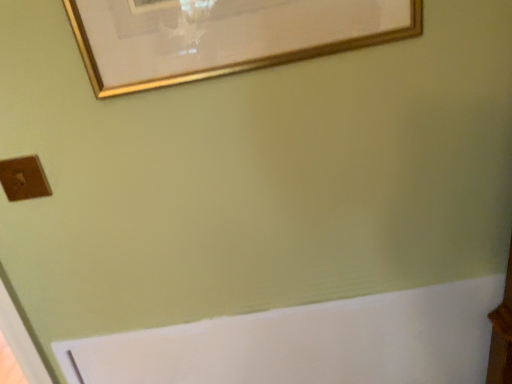
Question: From the image's perspective, is gold metallic picture frame at upper center positioned above or below brown matte/light switch at lower left?

Choices:
 (A) above
 (B) below

Answer: (A)

Question: Is gold metallic picture frame at upper center inside or outside of brown matte/light switch at lower left?

Choices:
 (A) inside
 (B) outside

Answer: (B)

Question: Based on their positions, is gold metallic picture frame at upper center located to the left or right of brown matte/light switch at lower left?

Choices:
 (A) right
 (B) left

Answer: (A)

Question: From a real-world perspective, is brown matte/light switch at lower left physically located above or below gold metallic picture frame at upper center?

Choices:
 (A) above
 (B) below

Answer: (B)

Question: Considering the positions of brown matte/light switch at lower left and gold metallic picture frame at upper center in the image, is brown matte/light switch at lower left taller or shorter than gold metallic picture frame at upper center?

Choices:
 (A) tall
 (B) short

Answer: (B)

Question: From the image's perspective, is brown matte/light switch at lower left above or below gold metallic picture frame at upper center?

Choices:
 (A) above
 (B) below

Answer: (B)

Question: In the image, is brown matte/light switch at lower left on the left side or the right side of gold metallic picture frame at upper center?

Choices:
 (A) left
 (B) right

Answer: (A)